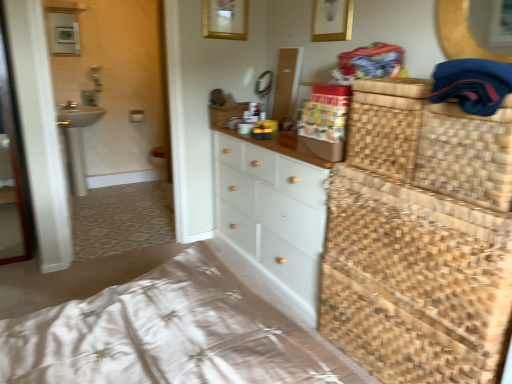
This screenshot has height=384, width=512. I want to click on vacant space in front of transparent glass screen door at left, so click(9, 271).